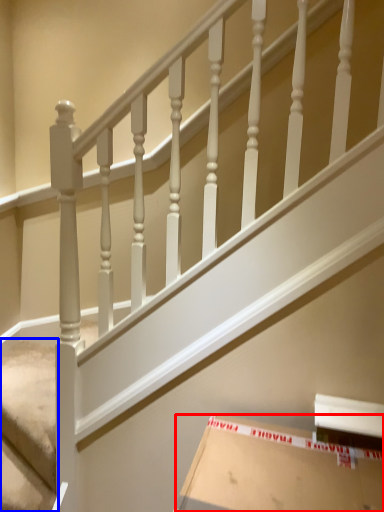
Question: Which of the following is the farthest to the observer, cardboard box (highlighted by a red box) or stairwell (highlighted by a blue box)?

Choices:
 (A) cardboard box
 (B) stairwell

Answer: (B)